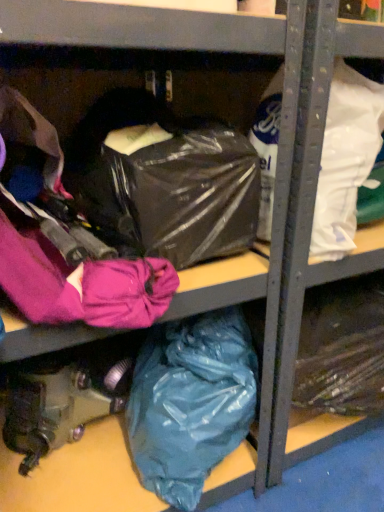
Question: From a real-world perspective, is white matte plastic bag at upper right, the first plastic bag in the top-to-bottom sequence, positioned over transparent plastic bag at center based on gravity?

Choices:
 (A) yes
 (B) no

Answer: (A)

Question: Is white matte plastic bag at upper right, which ranks as the 2th plastic bag in bottom-to-top order, at the left side of transparent plastic bag at center?

Choices:
 (A) yes
 (B) no

Answer: (B)

Question: Is white matte plastic bag at upper right, the first plastic bag in the top-to-bottom sequence, oriented away from transparent plastic bag at center?

Choices:
 (A) no
 (B) yes

Answer: (A)

Question: From the image's perspective, is white matte plastic bag at upper right, which ranks as the 2th plastic bag in bottom-to-top order, over transparent plastic bag at center?

Choices:
 (A) yes
 (B) no

Answer: (A)

Question: Is white matte plastic bag at upper right, the first plastic bag in the top-to-bottom sequence, outside of transparent plastic bag at center?

Choices:
 (A) no
 (B) yes

Answer: (B)

Question: Is white matte plastic bag at upper right, the first plastic bag in the top-to-bottom sequence, thinner than transparent plastic bag at center?

Choices:
 (A) yes
 (B) no

Answer: (A)

Question: From the image's perspective, is transparent plastic bag at center above teal matte plastic bag at lower center, which is counted as the first plastic bag, starting from the bottom?

Choices:
 (A) yes
 (B) no

Answer: (A)

Question: Is transparent plastic bag at center positioned in front of teal matte plastic bag at lower center, which is counted as the first plastic bag, starting from the bottom?

Choices:
 (A) yes
 (B) no

Answer: (A)

Question: Considering the relative positions of transparent plastic bag at center and teal matte plastic bag at lower center, which is counted as the first plastic bag, starting from the bottom, in the image provided, is transparent plastic bag at center to the left of teal matte plastic bag at lower center, which is counted as the first plastic bag, starting from the bottom, from the viewer's perspective?

Choices:
 (A) yes
 (B) no

Answer: (A)

Question: From the image's perspective, is transparent plastic bag at center beneath teal matte plastic bag at lower center, which is counted as the first plastic bag, starting from the bottom?

Choices:
 (A) yes
 (B) no

Answer: (B)

Question: From a real-world perspective, is transparent plastic bag at center on top of teal matte plastic bag at lower center, which is counted as the first plastic bag, starting from the bottom?

Choices:
 (A) yes
 (B) no

Answer: (A)

Question: Is transparent plastic bag at center thinner than teal matte plastic bag at lower center, the 2th plastic bag from the top?

Choices:
 (A) no
 (B) yes

Answer: (A)

Question: Are teal matte plastic bag at lower center, which is counted as the first plastic bag, starting from the bottom, and white matte plastic bag at upper right, the first plastic bag in the top-to-bottom sequence, beside each other?

Choices:
 (A) yes
 (B) no

Answer: (B)